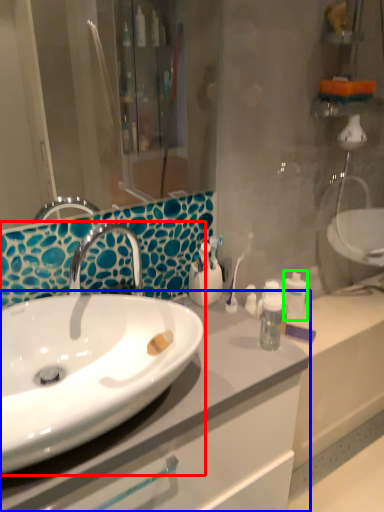
Question: Considering the real-world distances, which object is farthest from sink (highlighted by a red box)? bathroom cabinet (highlighted by a blue box) or mouthwash (highlighted by a green box)?

Choices:
 (A) bathroom cabinet
 (B) mouthwash

Answer: (B)